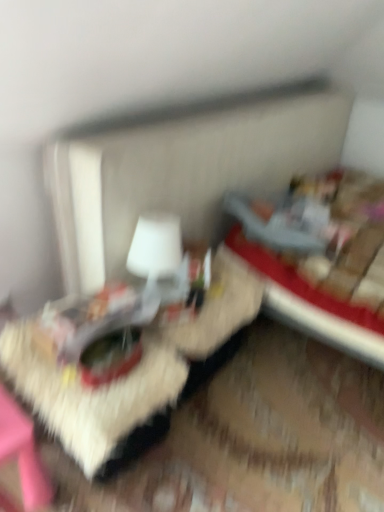
Question: Is the position of velvet red bed at right more distant than that of wooden textured table at center?

Choices:
 (A) yes
 (B) no

Answer: (A)

Question: From a real-world perspective, is velvet red bed at right below wooden textured table at center?

Choices:
 (A) no
 (B) yes

Answer: (A)

Question: Is velvet red bed at right next to wooden textured table at center and touching it?

Choices:
 (A) yes
 (B) no

Answer: (B)

Question: Does velvet red bed at right have a larger size compared to wooden textured table at center?

Choices:
 (A) yes
 (B) no

Answer: (A)

Question: Could wooden textured table at center be considered to be inside velvet red bed at right?

Choices:
 (A) no
 (B) yes

Answer: (A)

Question: Is velvet red bed at right to the left of wooden textured table at center from the viewer's perspective?

Choices:
 (A) no
 (B) yes

Answer: (A)

Question: From a real-world perspective, is white matte table lamp at center physically below wooden textured table at center?

Choices:
 (A) yes
 (B) no

Answer: (B)

Question: From a real-world perspective, is white matte table lamp at center located higher than wooden textured table at center?

Choices:
 (A) no
 (B) yes

Answer: (B)

Question: Does white matte table lamp at center have a larger size compared to wooden textured table at center?

Choices:
 (A) no
 (B) yes

Answer: (A)

Question: Is white matte table lamp at center not near wooden textured table at center?

Choices:
 (A) no
 (B) yes

Answer: (A)

Question: Can you confirm if white matte table lamp at center is thinner than wooden textured table at center?

Choices:
 (A) yes
 (B) no

Answer: (A)

Question: From the image's perspective, is white matte table lamp at center over wooden textured table at center?

Choices:
 (A) yes
 (B) no

Answer: (A)

Question: Can you confirm if velvet red bed at right is taller than white matte table lamp at center?

Choices:
 (A) no
 (B) yes

Answer: (B)